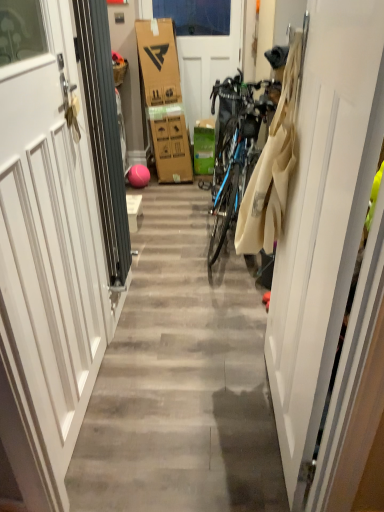
Question: Is point click(x=352, y=53) closer or farther from the camera than point click(x=206, y=133)?

Choices:
 (A) closer
 (B) farther

Answer: (A)

Question: From a real-world perspective, relative to green cardboard box at center, is white matte door at center, which is the first door from front to back, vertically above or below?

Choices:
 (A) above
 (B) below

Answer: (A)

Question: Estimate the real-world distances between objects in this image. Which object is farther from the white matte door at center, the 3th door viewed from the back?

Choices:
 (A) white matte door at left, marked as the 3th door in a right-to-left arrangement
 (B) beige cotton laundry at right
 (C) white matte door at center, positioned as the second door in left-to-right order
 (D) green cardboard box at center

Answer: (C)

Question: Which is farther from the beige cotton laundry at right?

Choices:
 (A) green cardboard box at center
 (B) white matte door at center, which is the first door from front to back
 (C) white matte door at center, which is counted as the first door, starting from the back
 (D) white matte door at left, which is the first door from left to right

Answer: (C)